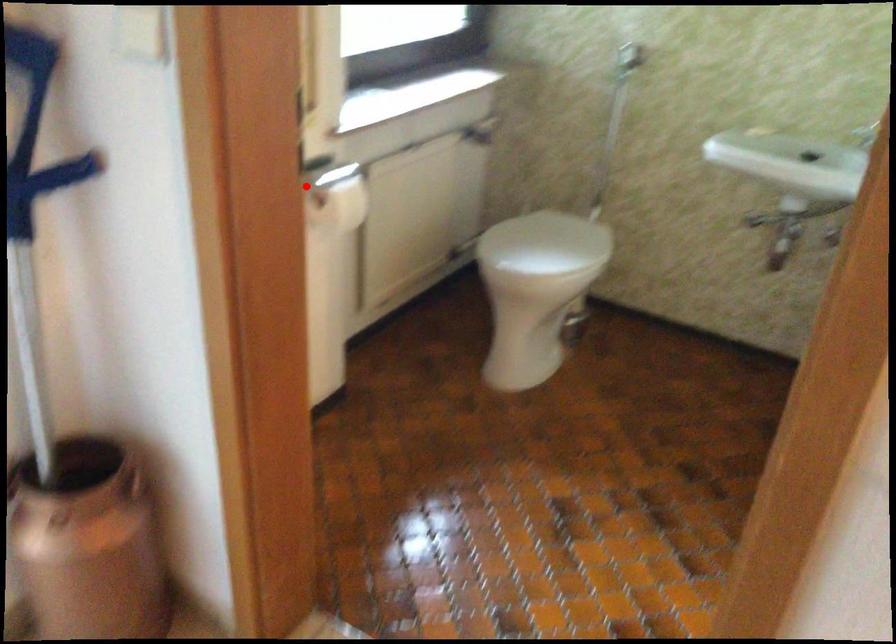
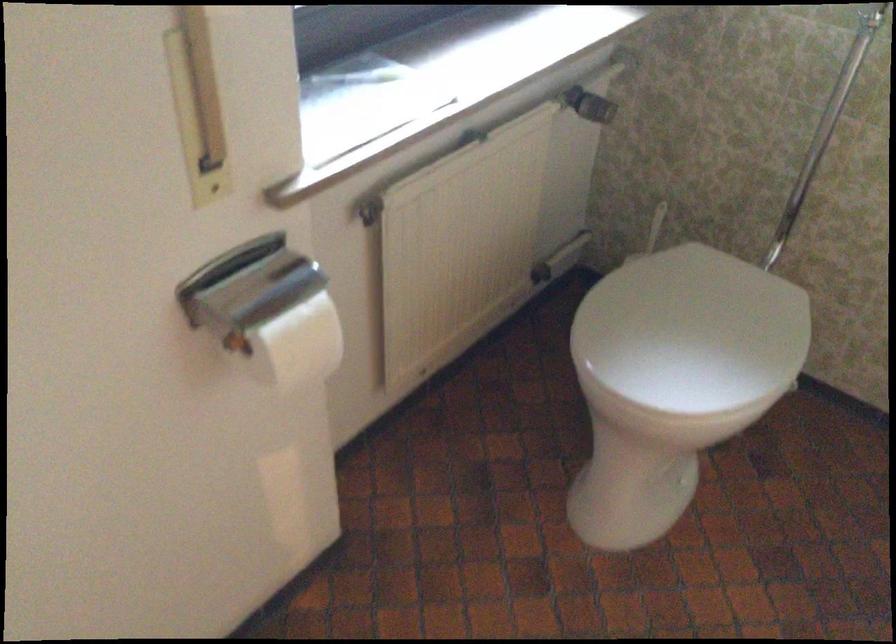
Find the pixel in the second image that matches the highlighted location in the first image.

(247, 285)